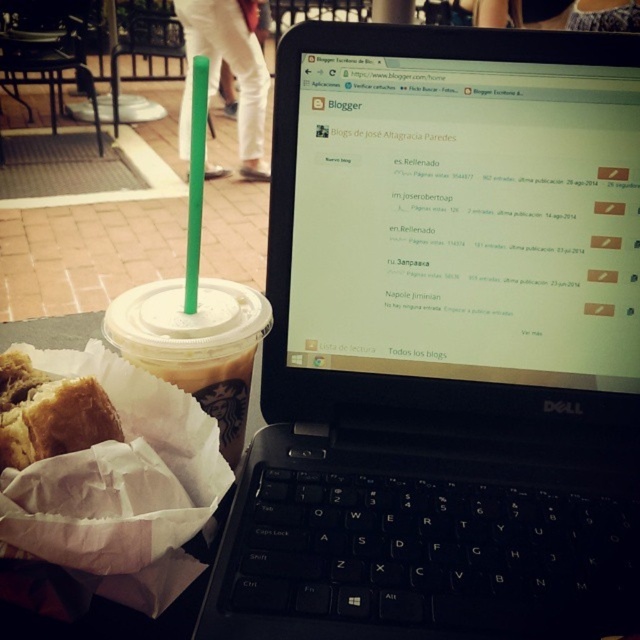
You are a person sitting at the table and want to pick up the golden brown bread at lower left. Is the black plastic laptop at center blocking your way?

The black plastic laptop at center is further to the viewer than golden brown bread at lower left, so it is blocking your path to the golden brown bread at lower left.

You are a barista at the Starbucks in the image. You need to place a new cup at point (195, 344). Is there already an object at that location?

Yes, there is already a translucent plastic cup at left at point (195, 344).

What are the coordinates of the black plastic laptop at center?

The black plastic laptop at center is located at coordinates point (444, 342).